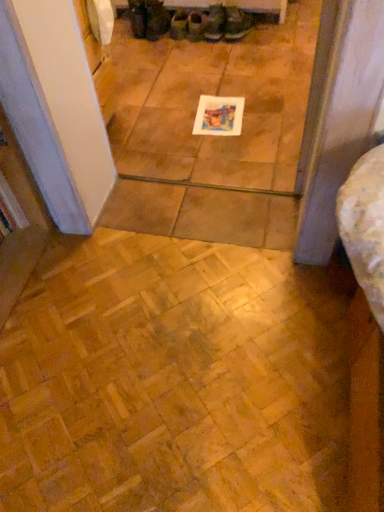
Identify the location of free space in front of green canvas shoes at upper center, arranged as the 4th footwear when viewed from the right. (182, 47).